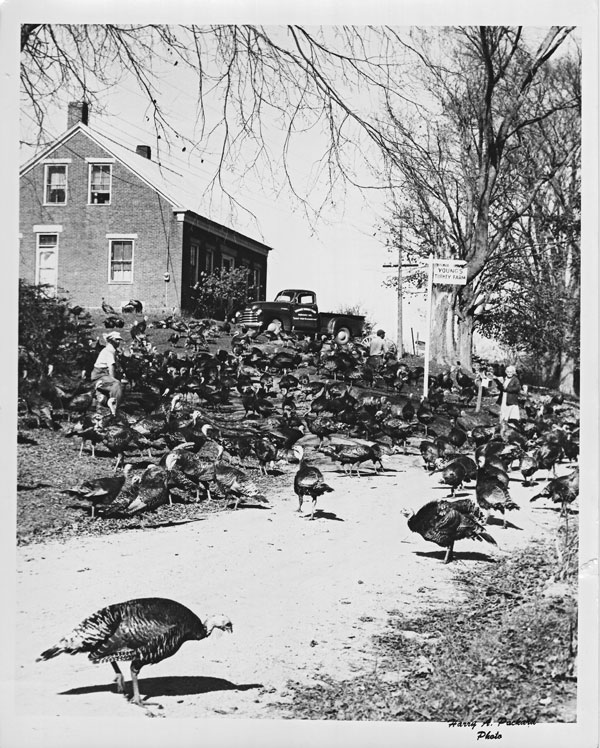
Find the location of a particular element. upstairs windows is located at coordinates (63, 182), (91, 187).